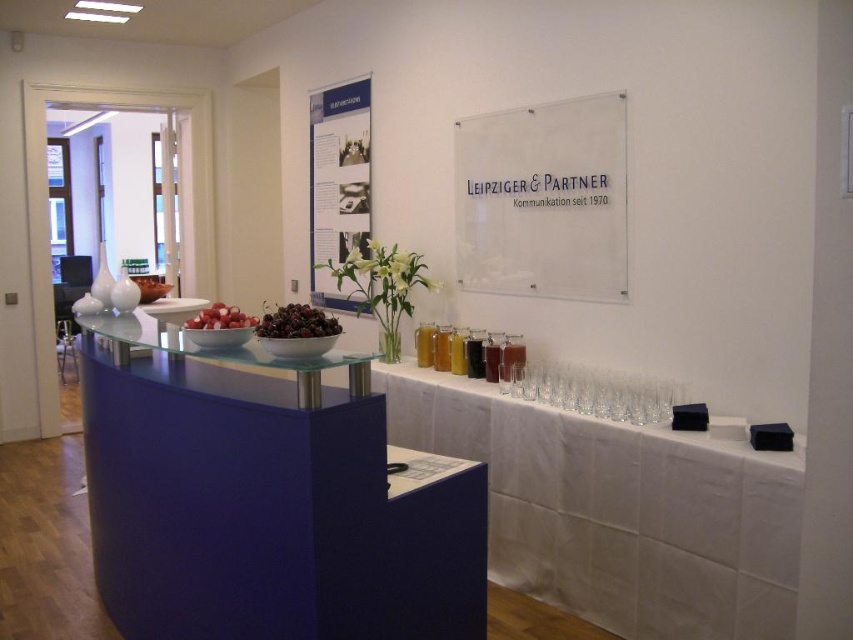
Which is above, matte blue table at center or shiny dark red cherries at center?

shiny dark red cherries at center

Does matte blue table at center have a lesser height compared to shiny dark red cherries at center?

In fact, matte blue table at center may be taller than shiny dark red cherries at center.

Image resolution: width=853 pixels, height=640 pixels. I want to click on matte blue table at center, so click(x=268, y=500).

Measure the distance from matte blue table at center to red matte radish at center.

matte blue table at center and red matte radish at center are 24.95 inches apart from each other.

The image size is (853, 640). Describe the element at coordinates (268, 500) in the screenshot. I see `matte blue table at center` at that location.

Find the location of `matte blue table at center`. matte blue table at center is located at coordinates (268, 500).

Is white fabric at lower right to the left of red matte radish at center from the viewer's perspective?

Incorrect, white fabric at lower right is not on the left side of red matte radish at center.

Consider the image. Is white fabric at lower right closer to the viewer compared to red matte radish at center?

That is False.

Is point (724, 442) behind point (218, 317)?

Yes, point (724, 442) is farther from viewer.

Locate an element on the screen. The image size is (853, 640). white fabric at lower right is located at coordinates (618, 509).